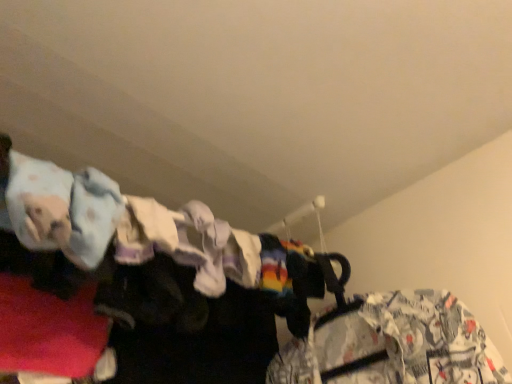
Image resolution: width=512 pixels, height=384 pixels. What do you see at coordinates (38, 202) in the screenshot?
I see `light blue fabric at upper left, which is the 1th clothing from top to bottom` at bounding box center [38, 202].

How much space does light blue fabric at upper left, acting as the first clothing starting from the left, occupy vertically?

It is 3.15 inches.

Measure the distance between light blue fabric at upper left, the second clothing viewed from the right, and camera.

light blue fabric at upper left, the second clothing viewed from the right, is 17.91 inches from camera.

Identify the location of light blue fabric at upper left, the second clothing viewed from the right. This screenshot has width=512, height=384. (38, 202).

The image size is (512, 384). I want to click on white printed fabric at right, the 2th clothing viewed from the top, so click(392, 344).

What is the approximate width of white printed fabric at right, the first clothing from the back?

white printed fabric at right, the first clothing from the back, is 4.18 inches wide.

What do you see at coordinates (392, 344) in the screenshot?
I see `white printed fabric at right, the first clothing from the back` at bounding box center [392, 344].

At what (x,y) coordinates should I click in order to perform the action: click on light blue fabric at upper left, the second clothing viewed from the right. Please return your answer as a coordinate pair (x, y). Looking at the image, I should click on (38, 202).

Would you say light blue fabric at upper left, which is the 1th clothing from top to bottom, is to the left or to the right of white printed fabric at right, which is counted as the second clothing, starting from the left, in the picture?

light blue fabric at upper left, which is the 1th clothing from top to bottom, is to the left of white printed fabric at right, which is counted as the second clothing, starting from the left.

Which object is further away from the camera, light blue fabric at upper left, which is the 1th clothing in front-to-back order, or white printed fabric at right, the 1th clothing when ordered from bottom to top?

white printed fabric at right, the 1th clothing when ordered from bottom to top, is further away from the camera.

Which is closer to the camera, (67, 208) or (324, 330)?

The point (67, 208) is closer to the camera.

From the image's perspective, is light blue fabric at upper left, the second clothing viewed from the right, beneath white printed fabric at right, which is counted as the 1th clothing, starting from the right?

No, from the image's perspective, light blue fabric at upper left, the second clothing viewed from the right, is not below white printed fabric at right, which is counted as the 1th clothing, starting from the right.

From a real-world perspective, between light blue fabric at upper left, which is the 1th clothing from top to bottom, and white printed fabric at right, the 2th clothing viewed from the top, who is vertically lower?

white printed fabric at right, the 2th clothing viewed from the top, from a real-world perspective.

Between light blue fabric at upper left, the second clothing viewed from the right, and white printed fabric at right, the 1th clothing when ordered from bottom to top, which one has larger width?

light blue fabric at upper left, the second clothing viewed from the right.

Looking at this image, considering the relative sizes of light blue fabric at upper left, acting as the second clothing starting from the bottom, and white printed fabric at right, the 1th clothing when ordered from bottom to top, in the image provided, is light blue fabric at upper left, acting as the second clothing starting from the bottom, shorter than white printed fabric at right, the 1th clothing when ordered from bottom to top,?

Indeed, light blue fabric at upper left, acting as the second clothing starting from the bottom, has a lesser height compared to white printed fabric at right, the 1th clothing when ordered from bottom to top.

Is light blue fabric at upper left, which is counted as the 2th clothing, starting from the back, bigger or smaller than white printed fabric at right, the 2th clothing viewed from the top?

light blue fabric at upper left, which is counted as the 2th clothing, starting from the back, is smaller than white printed fabric at right, the 2th clothing viewed from the top.

Would you say light blue fabric at upper left, which is the 1th clothing from top to bottom, is outside white printed fabric at right, which is counted as the second clothing, starting from the left?

light blue fabric at upper left, which is the 1th clothing from top to bottom, is positioned outside white printed fabric at right, which is counted as the second clothing, starting from the left.

Would you say light blue fabric at upper left, which is the 1th clothing in front-to-back order, is a long distance from white printed fabric at right, which is counted as the 1th clothing, starting from the right?

No, light blue fabric at upper left, which is the 1th clothing in front-to-back order, is not far from white printed fabric at right, which is counted as the 1th clothing, starting from the right.

Looking at this image, is light blue fabric at upper left, which is counted as the 2th clothing, starting from the back, oriented towards white printed fabric at right, the first clothing from the back?

No.

How many degrees apart are the facing directions of light blue fabric at upper left, which is counted as the 2th clothing, starting from the back, and white printed fabric at right, the 1th clothing when ordered from bottom to top?

light blue fabric at upper left, which is counted as the 2th clothing, starting from the back, and white printed fabric at right, the 1th clothing when ordered from bottom to top, are facing 78.6 degrees away from each other.

How distant is light blue fabric at upper left, which is counted as the 2th clothing, starting from the back, from white printed fabric at right, the 1th clothing when ordered from bottom to top?

22.16 inches.

Locate an element on the screen. clothing on the right of light blue fabric at upper left, which is the 1th clothing in front-to-back order is located at coordinates (392, 344).

In the image, is white printed fabric at right, the 1th clothing when ordered from bottom to top, on the left side or the right side of light blue fabric at upper left, acting as the first clothing starting from the left?

white printed fabric at right, the 1th clothing when ordered from bottom to top, is to the right of light blue fabric at upper left, acting as the first clothing starting from the left.

Who is more distant, white printed fabric at right, the first clothing from the back, or light blue fabric at upper left, which is counted as the 2th clothing, starting from the back?

white printed fabric at right, the first clothing from the back.

Does point (408, 346) come closer to viewer compared to point (38, 246)?

No, it is behind (38, 246).

From the image's perspective, which one is positioned higher, white printed fabric at right, the 1th clothing when ordered from bottom to top, or light blue fabric at upper left, which is the 1th clothing in front-to-back order?

light blue fabric at upper left, which is the 1th clothing in front-to-back order, is shown above in the image.

Based on the photo, from a real-world perspective, does white printed fabric at right, the 2th clothing viewed from the top, sit lower than light blue fabric at upper left, which is the 1th clothing from top to bottom?

Yes.

Considering the sizes of objects white printed fabric at right, the first clothing from the back, and light blue fabric at upper left, which is counted as the 2th clothing, starting from the back, in the image provided, who is thinner, white printed fabric at right, the first clothing from the back, or light blue fabric at upper left, which is counted as the 2th clothing, starting from the back,?

Thinner between the two is white printed fabric at right, the first clothing from the back.

Which of these two, white printed fabric at right, the 2th clothing viewed from the top, or light blue fabric at upper left, the second clothing viewed from the right, stands taller?

white printed fabric at right, the 2th clothing viewed from the top.

Looking at this image, in terms of size, does white printed fabric at right, the 2th clothing viewed from the top, appear bigger or smaller than light blue fabric at upper left, acting as the first clothing starting from the left?

white printed fabric at right, the 2th clothing viewed from the top, is bigger than light blue fabric at upper left, acting as the first clothing starting from the left.

Is white printed fabric at right, the second clothing in the front-to-back sequence, not inside light blue fabric at upper left, acting as the first clothing starting from the left?

Yes, white printed fabric at right, the second clothing in the front-to-back sequence, is not within light blue fabric at upper left, acting as the first clothing starting from the left.

Would you consider white printed fabric at right, the 2th clothing viewed from the top, to be distant from light blue fabric at upper left, the second clothing viewed from the right?

No, white printed fabric at right, the 2th clothing viewed from the top, is not far from light blue fabric at upper left, the second clothing viewed from the right.

Is white printed fabric at right, the second clothing in the front-to-back sequence, oriented towards light blue fabric at upper left, acting as the first clothing starting from the left?

Yes, white printed fabric at right, the second clothing in the front-to-back sequence, is aimed at light blue fabric at upper left, acting as the first clothing starting from the left.

How distant is white printed fabric at right, the 1th clothing when ordered from bottom to top, from light blue fabric at upper left, which is the 1th clothing from top to bottom?

They are 22.16 inches apart.

You are a GUI agent. You are given a task and a screenshot of the screen. Output one action in this format:
    pyautogui.click(x=<x>, y=<y>)
    Task: Click on the clothing positioned vertically above the white printed fabric at right, the second clothing in the front-to-back sequence (from a real-world perspective)
    The image size is (512, 384).
    Given the screenshot: What is the action you would take?
    pyautogui.click(x=38, y=202)

Locate an element on the screen. This screenshot has width=512, height=384. clothing located above the white printed fabric at right, which is counted as the second clothing, starting from the left (from the image's perspective) is located at coordinates (38, 202).

Where is `clothing that appears on the left of white printed fabric at right, which is counted as the 1th clothing, starting from the right`? The height and width of the screenshot is (384, 512). clothing that appears on the left of white printed fabric at right, which is counted as the 1th clothing, starting from the right is located at coordinates (38, 202).